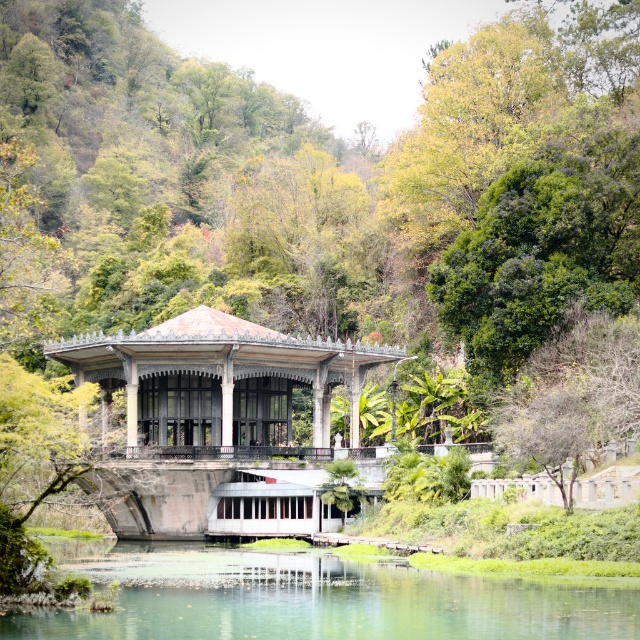
You are standing in the middle of the matte gray gazebo at center and want to walk to the clear water at center. Which direction should you head towards?

You should head to the left because the clear water at center is positioned on the right side of matte gray gazebo at center, so to reach it from the gazebo, you need to move towards the left direction.

You are planning to host a small gathering at the pavilion. If you want to set up a table and chairs for guests, which area would be more suitable between the clear water at center and the matte gray gazebo at center?

The matte gray gazebo at center is more suitable for setting up a table and chairs because it occupies more space than the clear water at center, providing enough room for guests.